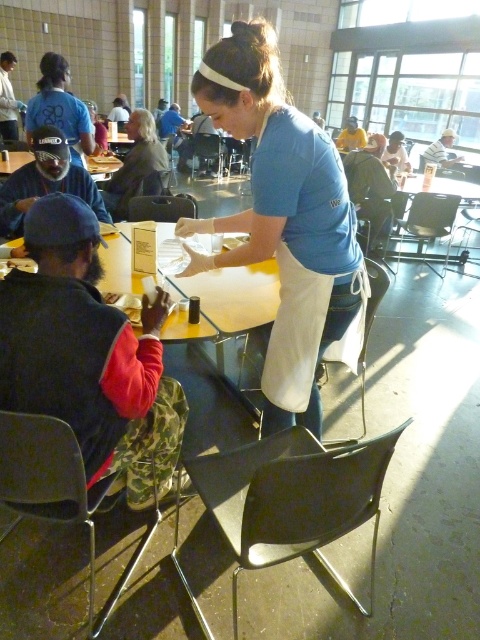
Question: Does blue cotton shirt at center appear on the right side of matte blue shirt at center?

Choices:
 (A) yes
 (B) no

Answer: (A)

Question: Among these points, which one is farthest from the camera?

Choices:
 (A) (88, 125)
 (B) (136, 115)
 (C) (248, 32)

Answer: (B)

Question: Which point is farther from the camera taking this photo?

Choices:
 (A) (74, 131)
 (B) (276, 342)
 (C) (122, 211)

Answer: (C)

Question: Can you confirm if matte blue shirt at upper left is thinner than matte blue shirt at center?

Choices:
 (A) no
 (B) yes

Answer: (A)

Question: Does matte blue shirt at upper left come behind matte blue shirt at center?

Choices:
 (A) yes
 (B) no

Answer: (B)

Question: Estimate the real-world distances between objects in this image. Which object is closer to the matte blue shirt at center?

Choices:
 (A) matte blue shirt at upper left
 (B) blue cotton shirt at center

Answer: (A)